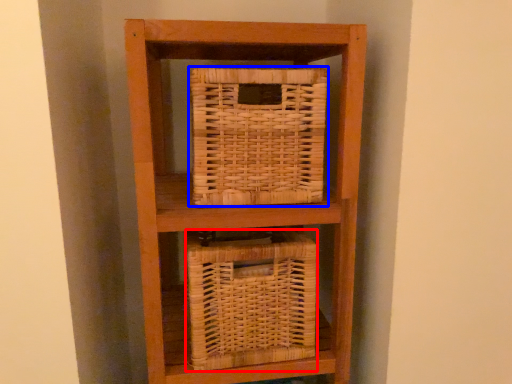
Question: Among these objects, which one is farthest to the camera, basket (highlighted by a red box) or basket (highlighted by a blue box)?

Choices:
 (A) basket
 (B) basket

Answer: (A)